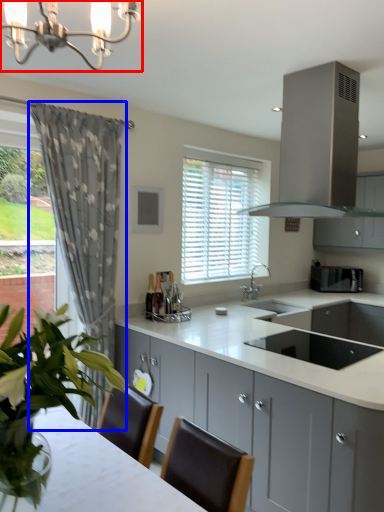
Question: Among these objects, which one is nearest to the camera, light fixture (highlighted by a red box) or curtain (highlighted by a blue box)?

Choices:
 (A) light fixture
 (B) curtain

Answer: (A)